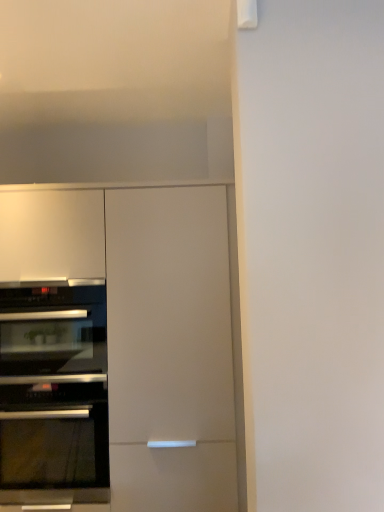
What do you see at coordinates (170, 349) in the screenshot? This screenshot has height=512, width=384. I see `matte white cabinet at left` at bounding box center [170, 349].

At what (x,y) coordinates should I click in order to perform the action: click on black glass oven at left, placed as the first oven when sorted from bottom to top. Please return your answer as a coordinate pair (x, y). Image resolution: width=384 pixels, height=512 pixels. Looking at the image, I should click on (53, 392).

You are a GUI agent. You are given a task and a screenshot of the screen. Output one action in this format:
    pyautogui.click(x=<x>, y=<y>)
    Task: Click on the black glass oven at left, positioned as the second oven in bottom-to-top order
    
    Given the screenshot: What is the action you would take?
    pyautogui.click(x=52, y=330)

From a real-world perspective, is black glass oven at left, which appears as the second oven when viewed from the top, positioned over matte white cabinet at left based on gravity?

No, from a real-world perspective, black glass oven at left, which appears as the second oven when viewed from the top, is not on top of matte white cabinet at left.

Is black glass oven at left, placed as the first oven when sorted from bottom to top, aimed at matte white cabinet at left?

Yes, black glass oven at left, placed as the first oven when sorted from bottom to top, is oriented towards matte white cabinet at left.

Considering the positions of objects black glass oven at left, placed as the first oven when sorted from bottom to top, and matte white cabinet at left in the image provided, who is more to the right, black glass oven at left, placed as the first oven when sorted from bottom to top, or matte white cabinet at left?

matte white cabinet at left.

Which is behind, point (46, 306) or point (119, 270)?

The point (46, 306) is behind.

Is black glass oven at left, positioned as the second oven in bottom-to-top order, turned away from matte white cabinet at left?

Absolutely, black glass oven at left, positioned as the second oven in bottom-to-top order, is directed away from matte white cabinet at left.

Is black glass oven at left, the first oven from the top, beside matte white cabinet at left?

No, black glass oven at left, the first oven from the top, is not with matte white cabinet at left.

Which object is thinner, black glass oven at left, positioned as the second oven in bottom-to-top order, or matte white cabinet at left?

black glass oven at left, positioned as the second oven in bottom-to-top order.

Can you tell me how much black glass oven at left, positioned as the second oven in bottom-to-top order, and matte white cabinet at left differ in facing direction?

0.0546 degrees.

Between matte white cabinet at left and black glass oven at left, placed as the first oven when sorted from bottom to top, which one has larger size?

With larger size is matte white cabinet at left.

Are matte white cabinet at left and black glass oven at left, which appears as the second oven when viewed from the top, beside each other?

No, matte white cabinet at left is not touching black glass oven at left, which appears as the second oven when viewed from the top.

Is matte white cabinet at left in front of black glass oven at left, which appears as the second oven when viewed from the top?

No, matte white cabinet at left is behind black glass oven at left, which appears as the second oven when viewed from the top.

Looking at this image, which object is further away from the camera taking this photo, black glass oven at left, the first oven from the top, or black glass oven at left, placed as the first oven when sorted from bottom to top?

black glass oven at left, the first oven from the top, is further from the camera.

Is black glass oven at left, positioned as the second oven in bottom-to-top order, situated inside black glass oven at left, which appears as the second oven when viewed from the top, or outside?

black glass oven at left, positioned as the second oven in bottom-to-top order, is outside black glass oven at left, which appears as the second oven when viewed from the top.

From a real-world perspective, who is located higher, black glass oven at left, positioned as the second oven in bottom-to-top order, or black glass oven at left, which appears as the second oven when viewed from the top?

black glass oven at left, positioned as the second oven in bottom-to-top order, from a real-world perspective.

Which is more to the right, black glass oven at left, the first oven from the top, or black glass oven at left, which appears as the second oven when viewed from the top?

From the viewer's perspective, black glass oven at left, which appears as the second oven when viewed from the top, appears more on the right side.

Who is more distant, matte white cabinet at left or black glass oven at left, positioned as the second oven in bottom-to-top order?

black glass oven at left, positioned as the second oven in bottom-to-top order, is further from the camera.

There is a matte white cabinet at left. At what (x,y) coordinates should I click in order to perform the action: click on oven above it (from a real-world perspective). Please return your answer as a coordinate pair (x, y). Image resolution: width=384 pixels, height=512 pixels. Looking at the image, I should click on (52, 330).

Can we say matte white cabinet at left lies outside black glass oven at left, the first oven from the top?

matte white cabinet at left is positioned outside black glass oven at left, the first oven from the top.

Consider the image. Is matte white cabinet at left turned away from black glass oven at left, positioned as the second oven in bottom-to-top order?

Yes, matte white cabinet at left is facing away from black glass oven at left, positioned as the second oven in bottom-to-top order.

Identify the location of oven that appears on the left of black glass oven at left, which appears as the second oven when viewed from the top. (52, 330).

Is black glass oven at left, positioned as the second oven in bottom-to-top order, inside black glass oven at left, which appears as the second oven when viewed from the top?

No, black glass oven at left, positioned as the second oven in bottom-to-top order, is located outside of black glass oven at left, which appears as the second oven when viewed from the top.

In terms of width, does black glass oven at left, which appears as the second oven when viewed from the top, look wider or thinner when compared to black glass oven at left, positioned as the second oven in bottom-to-top order?

Clearly, black glass oven at left, which appears as the second oven when viewed from the top, has more width compared to black glass oven at left, positioned as the second oven in bottom-to-top order.

Locate an element on the screen. The height and width of the screenshot is (512, 384). door behind the black glass oven at left, placed as the first oven when sorted from bottom to top is located at coordinates (170, 349).

At what (x,y) coordinates should I click in order to perform the action: click on door below the black glass oven at left, positioned as the second oven in bottom-to-top order (from the image's perspective). Please return your answer as a coordinate pair (x, y). Looking at the image, I should click on (170, 349).

Which object lies further to the anchor point black glass oven at left, placed as the first oven when sorted from bottom to top, matte white cabinet at left or black glass oven at left, the first oven from the top?

matte white cabinet at left.

From the image, which object appears to be nearer to black glass oven at left, the first oven from the top, matte white cabinet at left or black glass oven at left, placed as the first oven when sorted from bottom to top?

black glass oven at left, placed as the first oven when sorted from bottom to top, lies closer to black glass oven at left, the first oven from the top, than the other object.

Which object lies further to the anchor point black glass oven at left, which appears as the second oven when viewed from the top, black glass oven at left, positioned as the second oven in bottom-to-top order, or matte white cabinet at left?

matte white cabinet at left is positioned further to the anchor black glass oven at left, which appears as the second oven when viewed from the top.

Based on their spatial positions, is black glass oven at left, placed as the first oven when sorted from bottom to top, or matte white cabinet at left closer to black glass oven at left, positioned as the second oven in bottom-to-top order?

black glass oven at left, placed as the first oven when sorted from bottom to top.

Which object lies nearer to the anchor point matte white cabinet at left, black glass oven at left, positioned as the second oven in bottom-to-top order, or black glass oven at left, which appears as the second oven when viewed from the top?

black glass oven at left, which appears as the second oven when viewed from the top, is closer to matte white cabinet at left.

When comparing their distances from matte white cabinet at left, does black glass oven at left, placed as the first oven when sorted from bottom to top, or black glass oven at left, positioned as the second oven in bottom-to-top order, seem closer?

black glass oven at left, placed as the first oven when sorted from bottom to top.

In order to click on door between black glass oven at left, the first oven from the top, and black glass oven at left, placed as the first oven when sorted from bottom to top, vertically in this screenshot , I will do click(x=170, y=349).